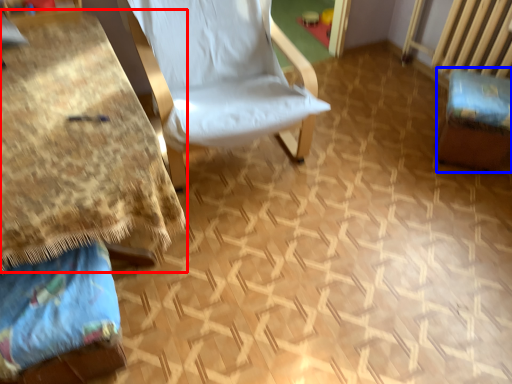
Question: Which object is further to the camera taking this photo, table (highlighted by a red box) or swivel chair (highlighted by a blue box)?

Choices:
 (A) table
 (B) swivel chair

Answer: (B)